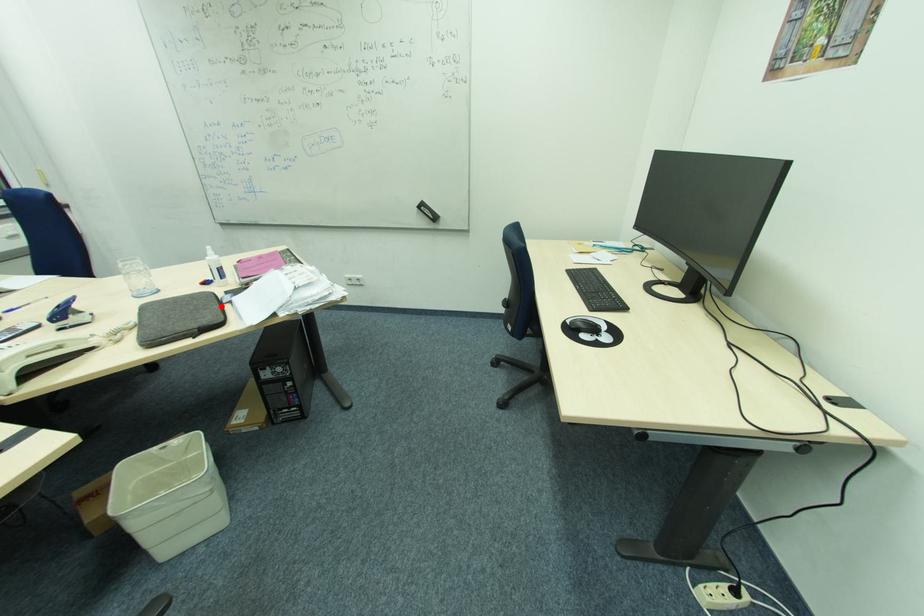
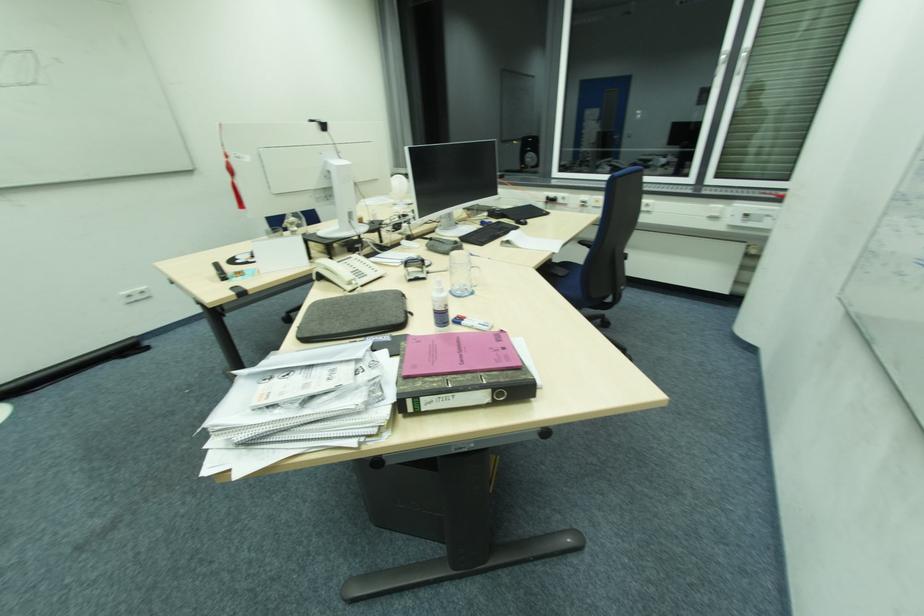
Locate, in the second image, the point that corresponds to the highlighted location in the first image.

(348, 331)